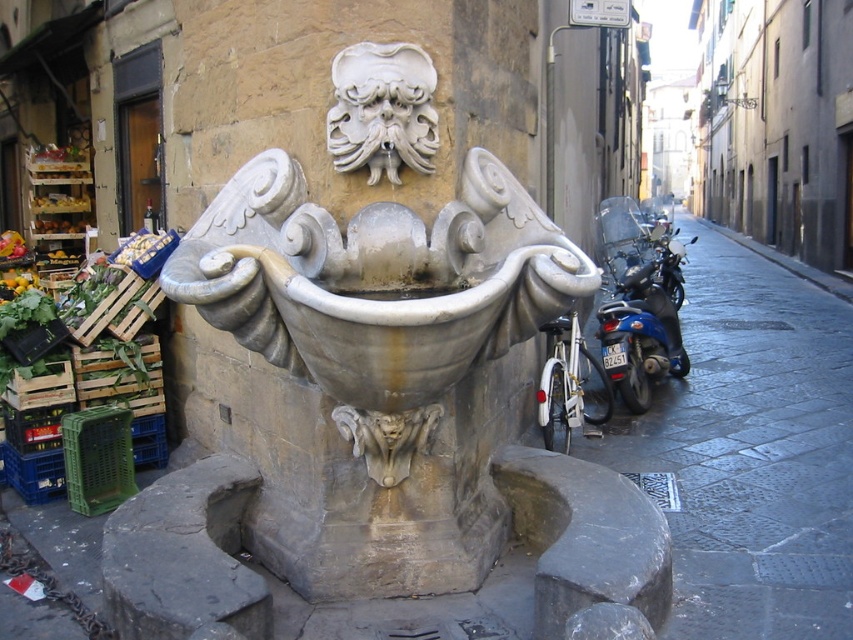
Is point (422, 154) closer to viewer compared to point (567, 436)?

Yes.

Can you confirm if white stone mask at center is wider than white matte motorbike at right?

In fact, white stone mask at center might be narrower than white matte motorbike at right.

Where is `white stone mask at center`? The width and height of the screenshot is (853, 640). white stone mask at center is located at coordinates (381, 109).

Image resolution: width=853 pixels, height=640 pixels. Find the location of `white stone mask at center`. white stone mask at center is located at coordinates (381, 109).

Which is behind, point (447, 392) or point (392, 156)?

The point (447, 392) is behind.

Does stone fountain at center have a lesser width compared to white stone mask at center?

In fact, stone fountain at center might be wider than white stone mask at center.

Find the location of a particular element. The width and height of the screenshot is (853, 640). stone fountain at center is located at coordinates (374, 416).

Is blue metallic motorcycle at right to the right of white matte motorbike at right from the viewer's perspective?

Yes, blue metallic motorcycle at right is to the right of white matte motorbike at right.

Can you confirm if blue metallic motorcycle at right is thinner than white matte motorbike at right?

Incorrect, blue metallic motorcycle at right's width is not less than white matte motorbike at right's.

Between point (659, 317) and point (549, 448), which one is positioned in front?

Point (549, 448) is in front.

At what (x,y) coordinates should I click in order to perform the action: click on blue metallic motorcycle at right. Please return your answer as a coordinate pair (x, y). The image size is (853, 640). Looking at the image, I should click on (639, 337).